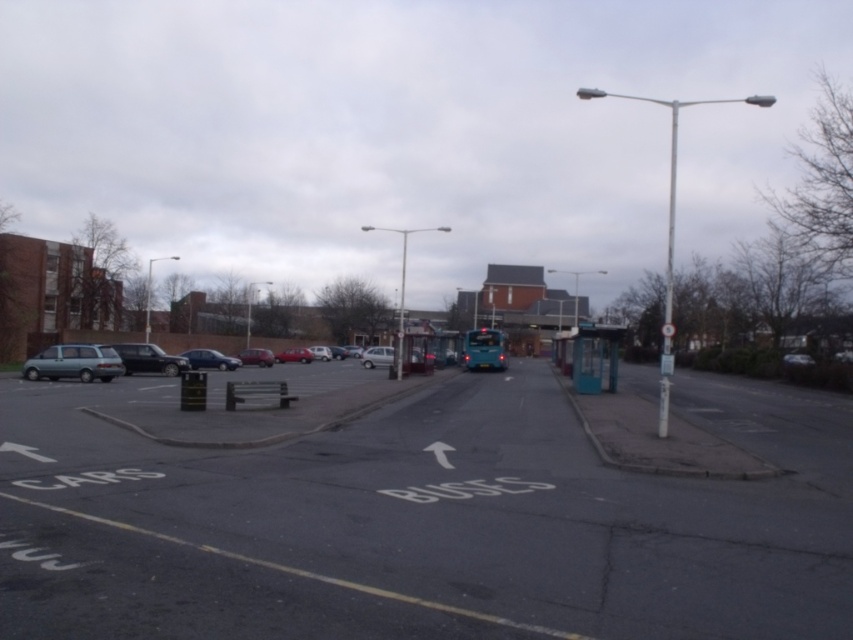
Consider the image. Is teal plastic bus stop at right to the right of metallic silver car at center-left from the viewer's perspective?

Yes, teal plastic bus stop at right is to the right of metallic silver car at center-left.

Is point (579, 385) behind point (187, 358)?

No.

Which is in front, point (576, 368) or point (218, 356)?

Positioned in front is point (576, 368).

Find the location of a particular element. teal plastic bus stop at right is located at coordinates (589, 355).

Is point (97, 352) positioned behind point (257, 364)?

No, it is not.

Does matte green minivan at left come behind matte black car at center?

That is False.

Locate an element on the screen. Image resolution: width=853 pixels, height=640 pixels. matte green minivan at left is located at coordinates (74, 362).

Is teal plastic bus stop at right bigger than matte red car at center?

Correct, teal plastic bus stop at right is larger in size than matte red car at center.

How much distance is there between teal plastic bus stop at right and matte red car at center?

A distance of 27.28 meters exists between teal plastic bus stop at right and matte red car at center.

Does point (602, 324) come behind point (281, 355)?

No, it is not.

The image size is (853, 640). Find the location of `teal plastic bus stop at right`. teal plastic bus stop at right is located at coordinates (589, 355).